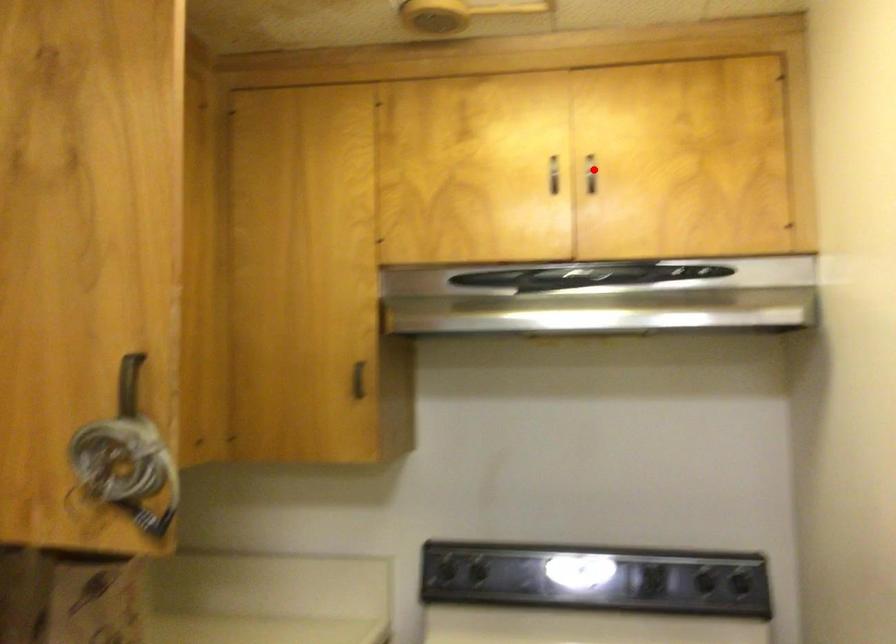
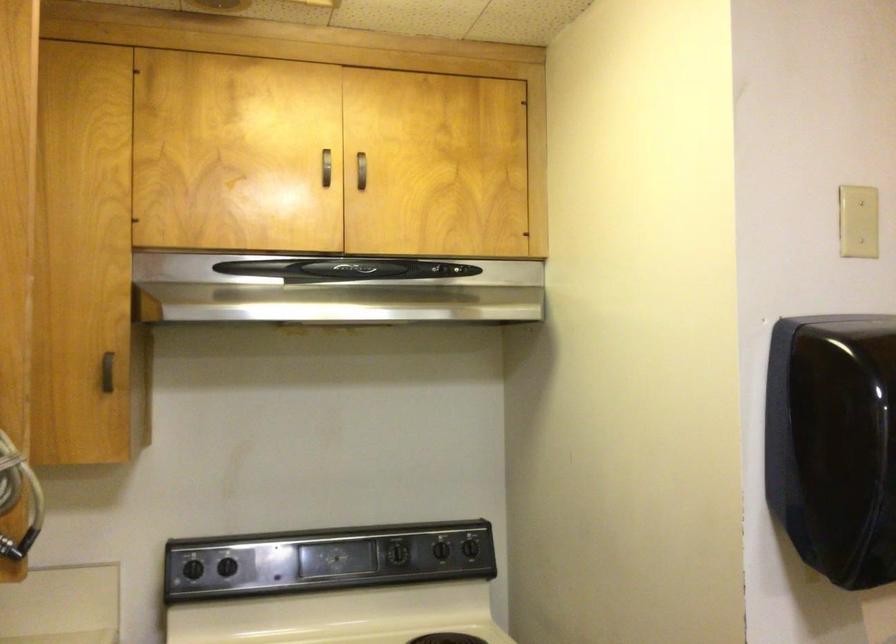
Locate, in the second image, the point that corresponds to the highlighted location in the first image.

(362, 169)